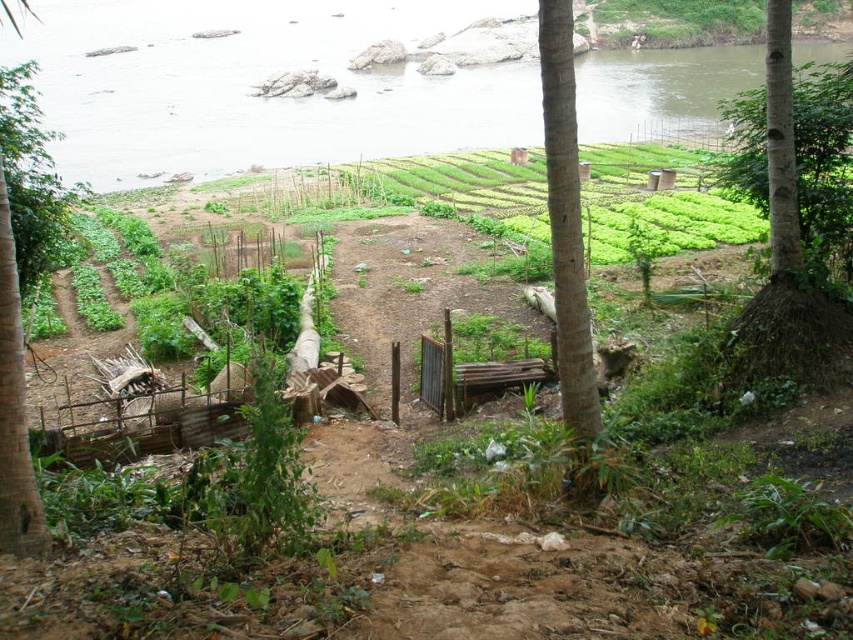
Question: Does green water at upper center appear on the left side of brown rough tree trunk at center?

Choices:
 (A) no
 (B) yes

Answer: (B)

Question: Which object is closer to the camera taking this photo?

Choices:
 (A) smooth bark tree at right
 (B) green water at upper center
 (C) green rough bark tree at right
 (D) brown rough tree trunk at center

Answer: (D)

Question: From the image, what is the correct spatial relationship of green water at upper center in relation to brown rough tree trunk at center?

Choices:
 (A) left
 (B) right

Answer: (A)

Question: Which point is closer to the camera?

Choices:
 (A) green rough bark tree at right
 (B) smooth bark tree at right
 (C) green water at upper center
 (D) brown rough tree trunk at center

Answer: (D)

Question: Which object is farther from the camera taking this photo?

Choices:
 (A) smooth bark tree at right
 (B) green water at upper center
 (C) brown rough tree trunk at center

Answer: (B)

Question: Is green water at upper center to the left of brown rough tree trunk at center from the viewer's perspective?

Choices:
 (A) yes
 (B) no

Answer: (A)